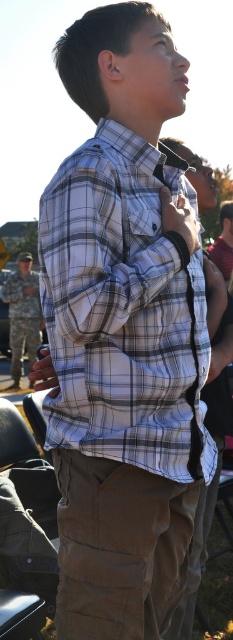
You are planning to take a photo of the plaid cotton shirt at center and camouflage fabric uniform at left. What is the minimum distance you need to move backward to ensure both are in frame?

The plaid cotton shirt at center and camouflage fabric uniform at left are 39.17 feet apart. To capture both in the same frame, you need to position yourself at least 39.17 feet away from the closest object, ensuring the entire distance between them fits within your camera lens view.

You are organizing a costume party and need to arrange two outfits displayed on mannequins. The outfits are the plaid cotton shirt at center and the camouflage fabric uniform at left. According to the scene, which outfit is placed to the right of the other?

The plaid cotton shirt at center is positioned on the right side of camouflage fabric uniform at left, so the plaid cotton shirt at center is to the right of the camouflage fabric uniform at left.

In the scene shown: You are organizing a clothing donation drive and need to determine which item takes up more space in the storage container. Based on the image, which item between the plaid cotton shirt at center and the camouflage fabric uniform at left requires more storage space?

The camouflage fabric uniform at left requires more storage space because it occupies more space than the plaid cotton shirt at center.